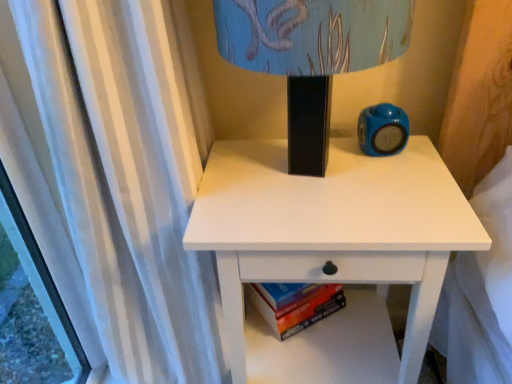
Question: Choose the correct answer: Is white matte nightstand at center inside matte black lampshade at upper center or outside it?

Choices:
 (A) outside
 (B) inside

Answer: (A)

Question: Would you say white matte nightstand at center is to the left or to the right of matte black lampshade at upper center in the picture?

Choices:
 (A) left
 (B) right

Answer: (B)

Question: Which is nearer to the matte plastic alarm clock at upper right?

Choices:
 (A) white matte nightstand at center
 (B) hardcover book at lower center
 (C) matte black lampshade at upper center

Answer: (A)

Question: Which object is positioned farthest from the matte plastic alarm clock at upper right?

Choices:
 (A) hardcover book at lower center
 (B) white matte nightstand at center
 (C) matte black lampshade at upper center

Answer: (A)